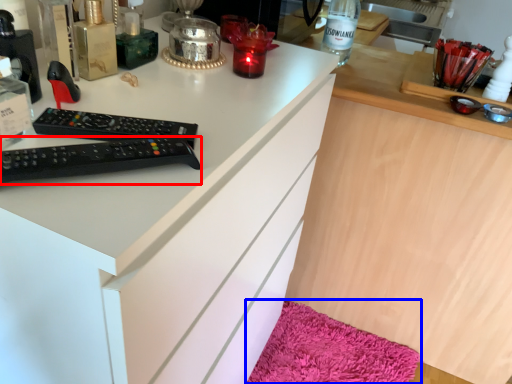
Question: Which of the following is the farthest to the observer, remote control (highlighted by a red box) or bath mat (highlighted by a blue box)?

Choices:
 (A) remote control
 (B) bath mat

Answer: (B)